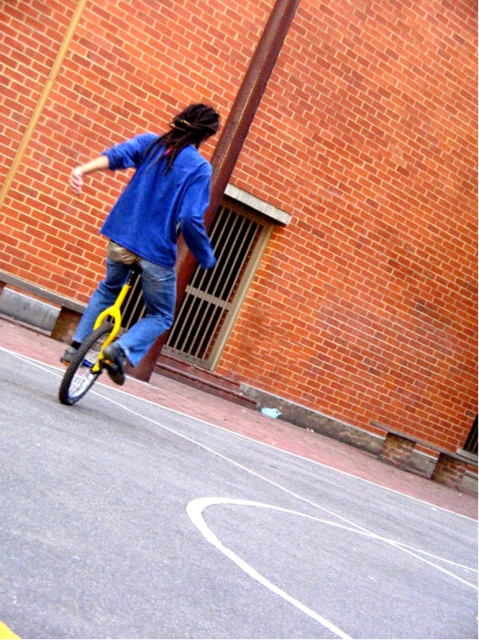
You are a delivery person who needs to place a small package between the blue denim jacket at center and the yellow matte bicycle at lower left. Can you fit it there?

The blue denim jacket at center and yellow matte bicycle at lower left are 14.99 inches apart, so yes, the small package can fit between them as the space is sufficient.

You are a delivery person who needs to carry a large package. You see a blue denim jacket at center and a yellow matte bicycle at lower left. Which item can you use to carry the package?

The blue denim jacket at center has a larger size compared to the yellow matte bicycle at lower left, so the blue denim jacket at center would be better for carrying the package.